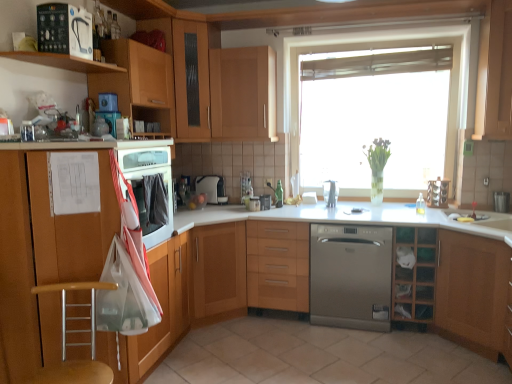
Question: Is wooden seat at lower left facing away from wooden cabinet at upper center, positioned as the 5th cabinetry in left-to-right order?

Choices:
 (A) yes
 (B) no

Answer: (B)

Question: Considering the relative positions of wooden seat at lower left and wooden cabinet at upper center, positioned as the 5th cabinetry in left-to-right order, in the image provided, is wooden seat at lower left in front of wooden cabinet at upper center, positioned as the 5th cabinetry in left-to-right order,?

Choices:
 (A) yes
 (B) no

Answer: (A)

Question: Is the surface of wooden seat at lower left in direct contact with wooden cabinet at upper center, arranged as the fourth cabinetry when viewed from the right?

Choices:
 (A) yes
 (B) no

Answer: (B)

Question: Considering the relative sizes of wooden seat at lower left and wooden cabinet at upper center, arranged as the fourth cabinetry when viewed from the right, in the image provided, is wooden seat at lower left shorter than wooden cabinet at upper center, arranged as the fourth cabinetry when viewed from the right,?

Choices:
 (A) yes
 (B) no

Answer: (A)

Question: Does wooden seat at lower left appear on the right side of wooden cabinet at upper center, arranged as the fourth cabinetry when viewed from the right?

Choices:
 (A) yes
 (B) no

Answer: (B)

Question: Is matte wood cabinet at left, which appears as the 1th cabinetry when viewed from the left, wider or thinner than wooden shelf at upper left, the first shelf in the front-to-back sequence?

Choices:
 (A) wide
 (B) thin

Answer: (A)

Question: In the image, is matte wood cabinet at left, which is counted as the 8th cabinetry, starting from the right, positioned in front of or behind wooden shelf at upper left, the first shelf in the front-to-back sequence?

Choices:
 (A) behind
 (B) front

Answer: (B)

Question: Visually, is matte wood cabinet at left, which is counted as the 8th cabinetry, starting from the right, positioned to the left or to the right of wooden shelf at upper left, acting as the second shelf starting from the back?

Choices:
 (A) left
 (B) right

Answer: (B)

Question: From the image's perspective, is matte wood cabinet at left, which is counted as the 8th cabinetry, starting from the right, located above or below wooden shelf at upper left, acting as the 2th shelf starting from the bottom?

Choices:
 (A) below
 (B) above

Answer: (A)

Question: From a real-world perspective, is wooden cabinet at upper left, which is counted as the 2th cabinetry, starting from the left, positioned above or below wooden seat at lower left?

Choices:
 (A) below
 (B) above

Answer: (B)

Question: Considering the positions of wooden cabinet at upper left, placed as the seventh cabinetry when sorted from right to left, and wooden seat at lower left in the image, is wooden cabinet at upper left, placed as the seventh cabinetry when sorted from right to left, bigger or smaller than wooden seat at lower left?

Choices:
 (A) big
 (B) small

Answer: (A)

Question: Is wooden cabinet at upper left, placed as the seventh cabinetry when sorted from right to left, inside or outside of wooden seat at lower left?

Choices:
 (A) inside
 (B) outside

Answer: (B)

Question: Considering the positions of wooden cabinet at upper left, placed as the seventh cabinetry when sorted from right to left, and wooden seat at lower left in the image, is wooden cabinet at upper left, placed as the seventh cabinetry when sorted from right to left, taller or shorter than wooden seat at lower left?

Choices:
 (A) tall
 (B) short

Answer: (A)

Question: Is light wood/wooden cabinet at center, which is counted as the sixth cabinetry, starting from the left, taller or shorter than wooden cabinet at lower right, which is the second cabinetry from right to left?

Choices:
 (A) short
 (B) tall

Answer: (A)

Question: Considering the positions of point (303, 309) and point (457, 281), is point (303, 309) closer or farther from the camera than point (457, 281)?

Choices:
 (A) closer
 (B) farther

Answer: (B)